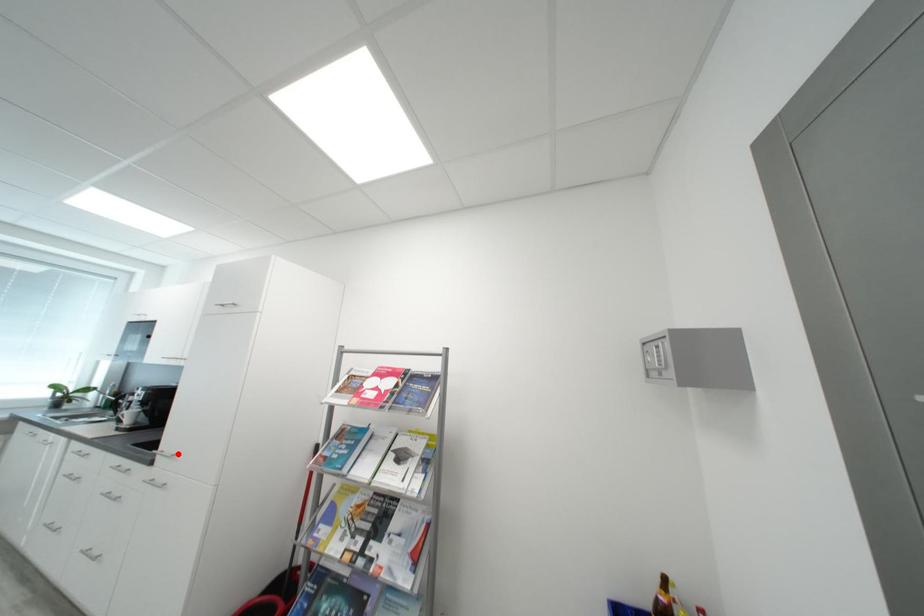
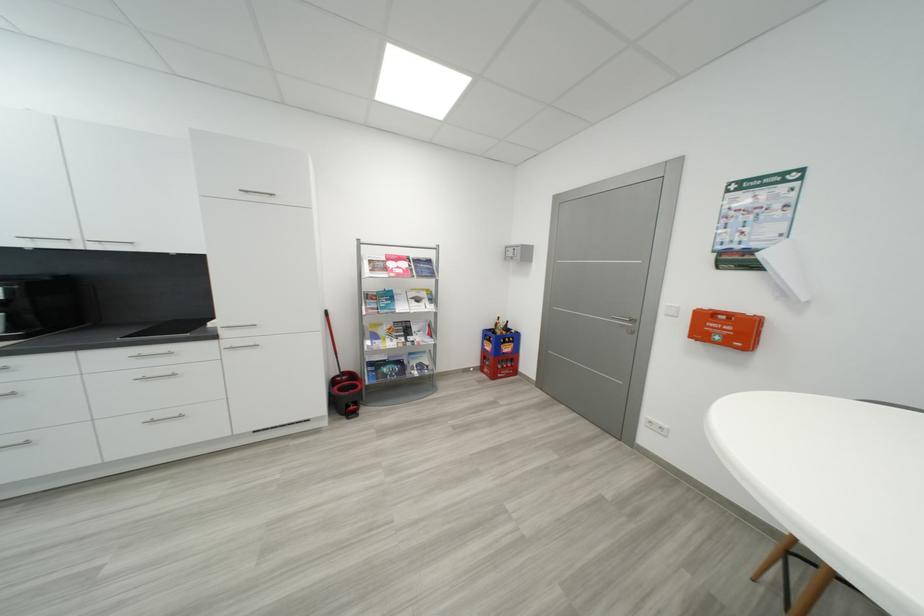
Where in the second image is the point corresponding to the highlighted location from the first image?

(256, 325)